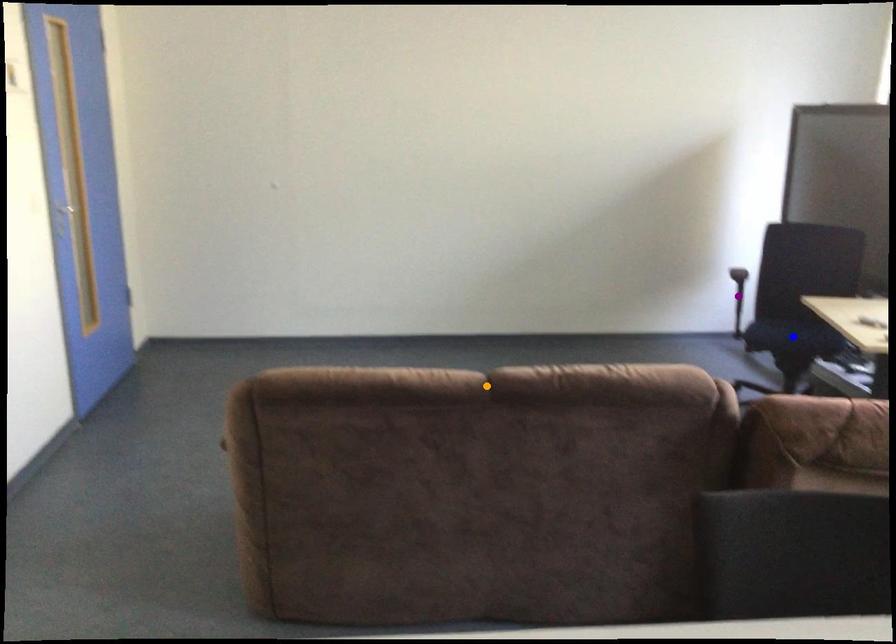
Order these from nearest to farthest:
orange point, blue point, purple point

purple point, blue point, orange point